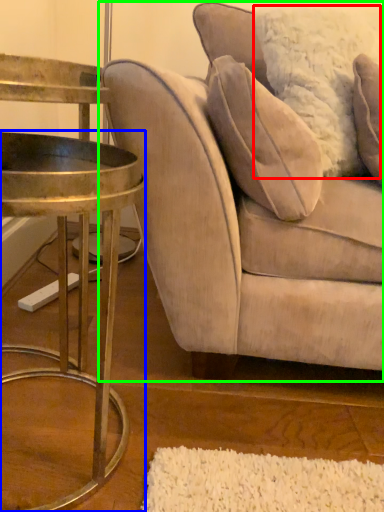
Question: Which is farther away from pillow (highlighted by a red box)? table (highlighted by a blue box) or studio couch (highlighted by a green box)?

Choices:
 (A) table
 (B) studio couch

Answer: (A)